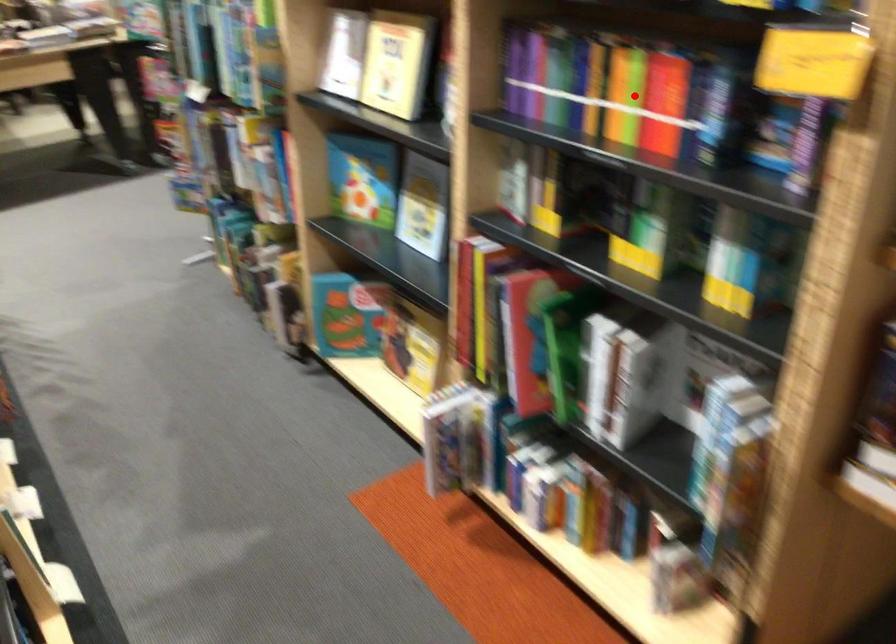
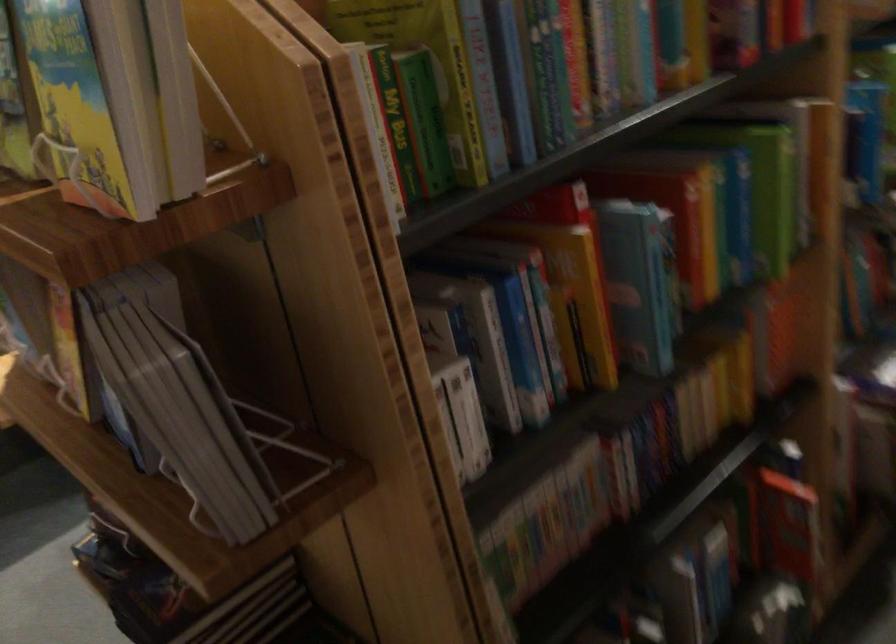
Question: I am providing you with two images of the same scene from different viewpoints. A red point is marked on the first image. Is the red point's position out of view in image 2?

Choices:
 (A) Yes
 (B) No

Answer: (A)